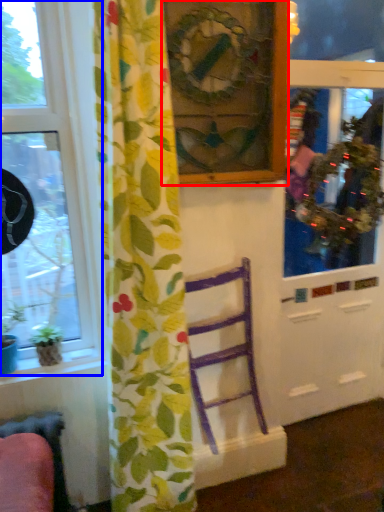
Question: Which of the following is the closest to the observer, picture frame (highlighted by a red box) or window (highlighted by a blue box)?

Choices:
 (A) picture frame
 (B) window

Answer: (B)